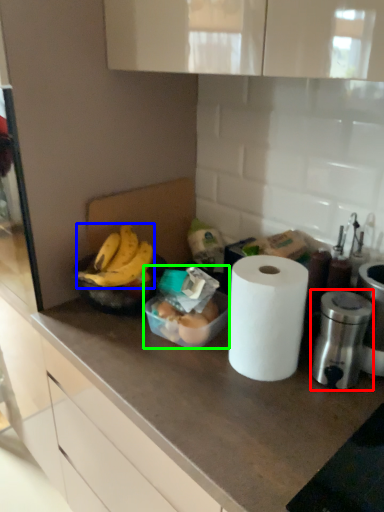
Question: Which object is positioned closest to appliance (highlighted by a red box)? Select from banana (highlighted by a blue box) and food (highlighted by a green box).

Choices:
 (A) banana
 (B) food

Answer: (B)